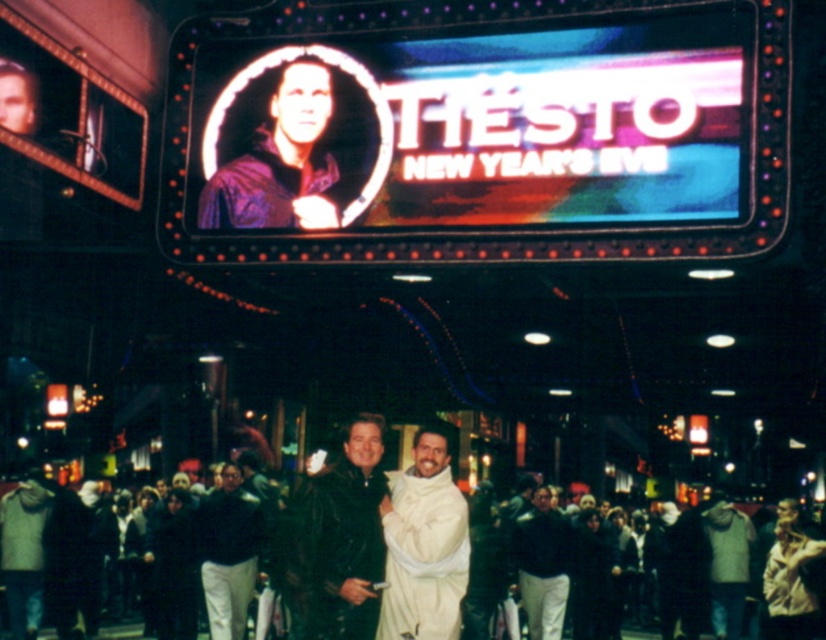
You are standing at the base of the THESTO billboard in Times Square. You want to take a photo of the billboard without any people in the frame. There is a point at coordinates point (393, 605) that is 191.93 feet away from you. Can you estimate if this point is far enough to avoid the crowd below the billboard?

The point at coordinates point (393, 605) is 191.93 feet away from you. This distance is likely far enough to avoid the crowd below the billboard, as the crowd is described as being at the base of the billboard and the point is significantly distant, providing a clear vantage point.